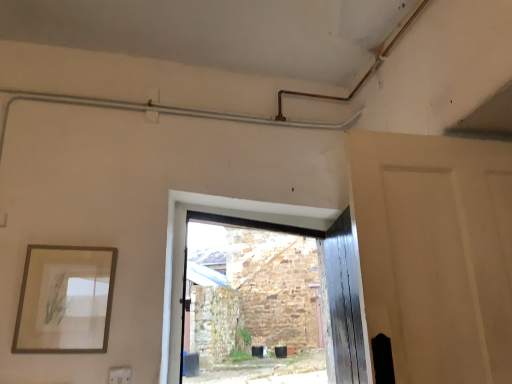
Question: Is point click(x=28, y=321) closer or farther from the camera than point click(x=118, y=370)?

Choices:
 (A) closer
 (B) farther

Answer: (A)

Question: Is wooden picture frame at left bigger or smaller than white plastic electric outlet at lower left?

Choices:
 (A) big
 (B) small

Answer: (A)

Question: Which of these objects is positioned closest to the wooden picture frame at left?

Choices:
 (A) matte white door at right
 (B) white plastic electric outlet at lower left

Answer: (B)

Question: Which object is the farthest from the matte white door at right?

Choices:
 (A) white plastic electric outlet at lower left
 (B) wooden picture frame at left

Answer: (A)